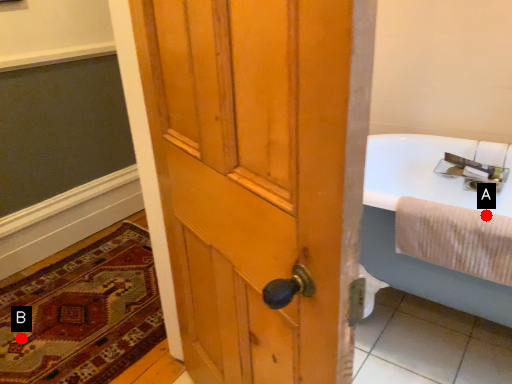
Question: Two points are circled on the image, labeled by A and B beside each circle. Which point appears farthest from the camera in this image?

Choices:
 (A) A is further
 (B) B is further

Answer: (B)